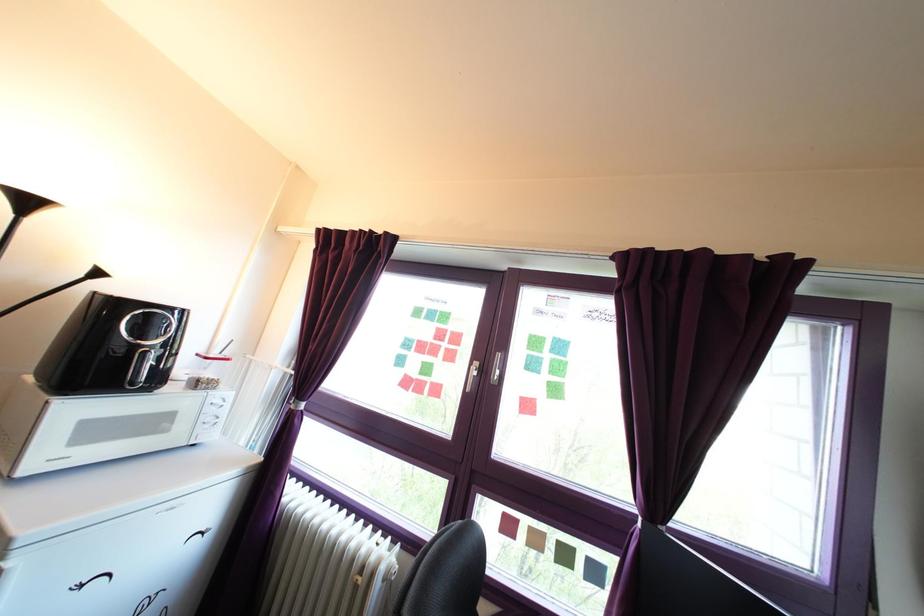
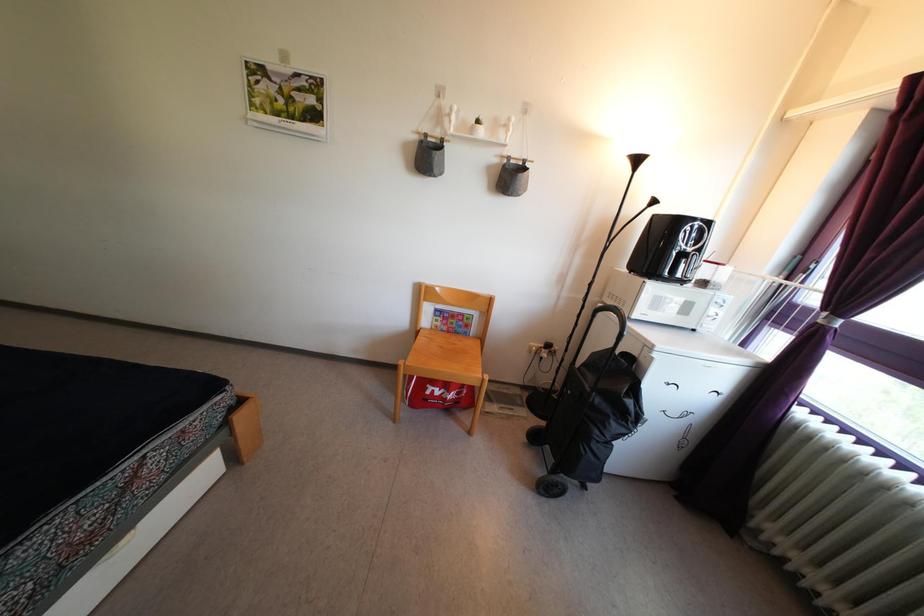
Question: The camera is either moving clockwise (left) or counter-clockwise (right) around the object. The first image is from the beginning of the video and the second image is from the end. Is the camera moving left or right when shooting the video?

Choices:
 (A) Left
 (B) Right

Answer: (B)